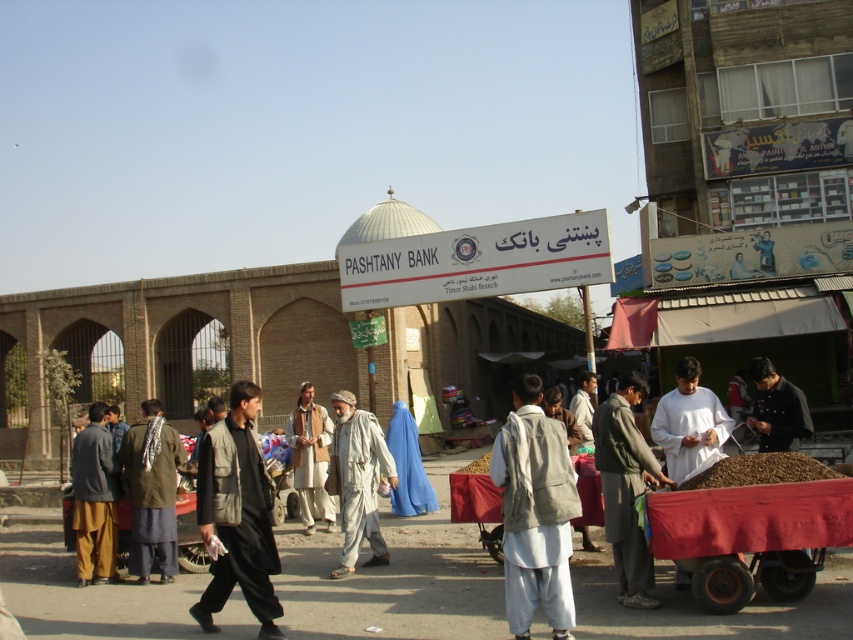
Which is behind, point (498, 474) or point (350, 513)?

The point (350, 513) is behind.

Is light gray fabric vest at center to the left of light beige fabric at center from the viewer's perspective?

Incorrect, light gray fabric vest at center is not on the left side of light beige fabric at center.

Find the location of `light gray fabric vest at center`. light gray fabric vest at center is located at coordinates (535, 513).

The height and width of the screenshot is (640, 853). I want to click on light gray fabric vest at center, so (x=535, y=513).

Who is positioned more to the left, light gray fabric vest at center or dark gray fabric cart at lower right?

Positioned to the left is light gray fabric vest at center.

Between point (541, 538) and point (621, 490), which one is positioned in front?

Positioned in front is point (541, 538).

Is point (518, 440) in front of point (608, 502)?

Yes.

The height and width of the screenshot is (640, 853). What are the coordinates of `light gray fabric vest at center` in the screenshot? It's located at (535, 513).

Can you confirm if light beige fabric at center is positioned below light brown leather vest at center?

Indeed, light beige fabric at center is positioned under light brown leather vest at center.

Where is `light beige fabric at center`? light beige fabric at center is located at coordinates (358, 481).

Who is more forward, (352, 545) or (312, 436)?

Point (352, 545)

This screenshot has width=853, height=640. In order to click on light beige fabric at center in this screenshot , I will do `click(358, 481)`.